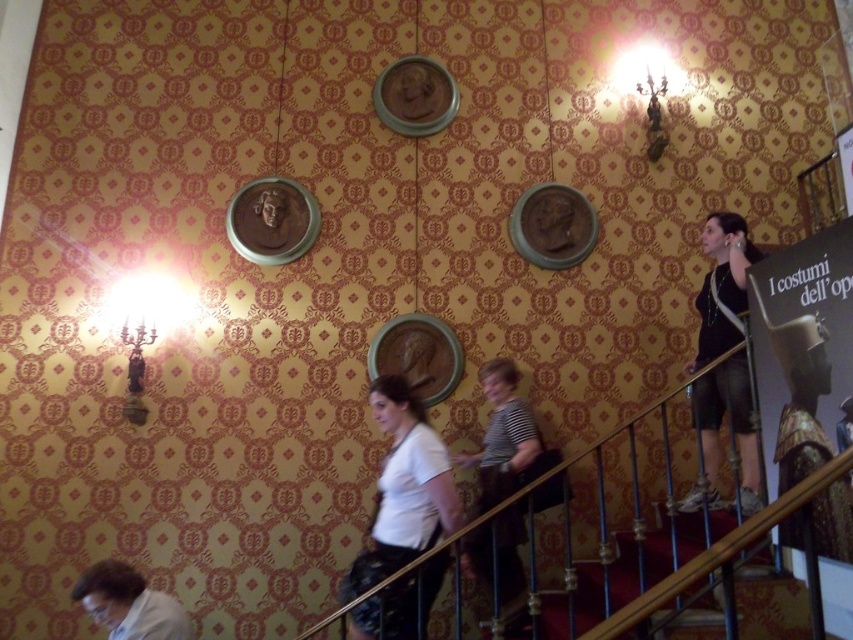
You are standing in the room and see the white matte shirt at center. If you want to reach it without moving your feet, can you do it?

The white matte shirt at center is 9.18 feet away from viewer. Since it is too far to reach without moving your feet, you cannot do so.

You are standing in the room and want to place a new painting exactly where the dark gray fabric shorts at right are currently located. What coordinates should you use for the painting?

You should place the painting at coordinates point (730,429), as that is where the dark gray fabric shorts at right are located.